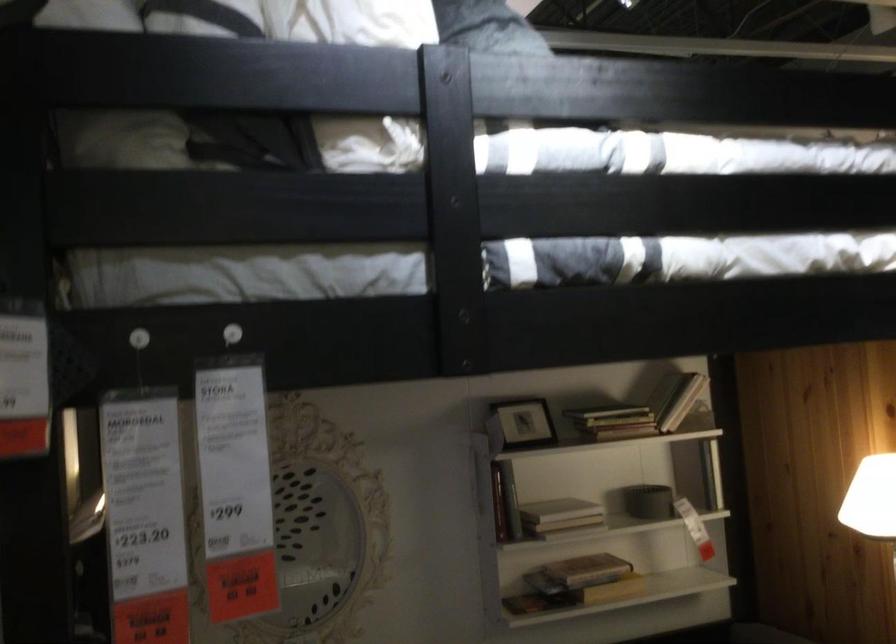
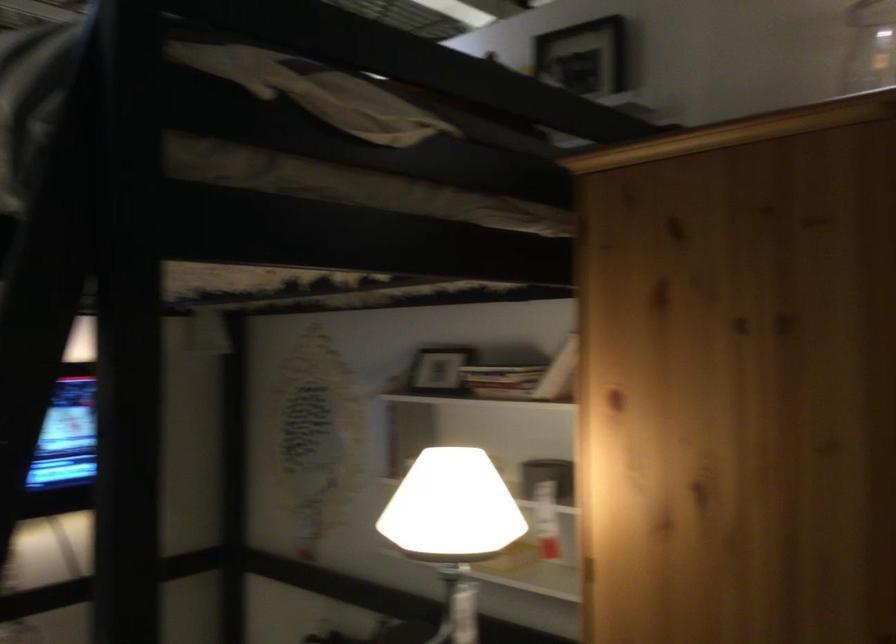
In the second image, find the point that corresponds to point (655, 413) in the first image.

(501, 379)